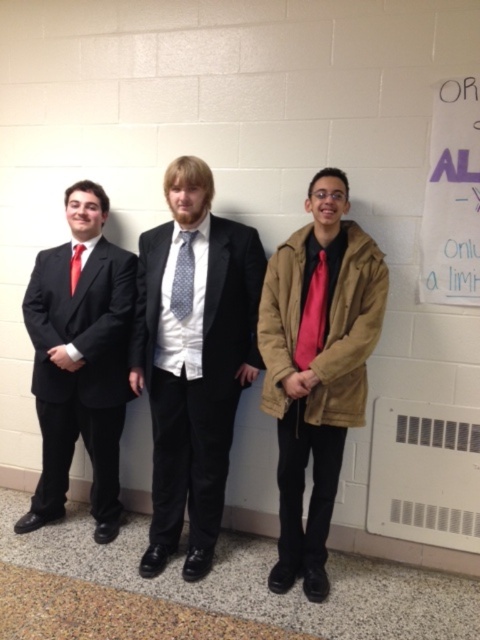
Is point (88, 380) positioned behind point (76, 275)?

No, (88, 380) is closer to viewer.

Does matte black suit at left lie behind matte red tie at left?

That is False.

This screenshot has width=480, height=640. I want to click on matte black suit at left, so click(x=80, y=362).

Can you confirm if tan suede jacket at center is shorter than matte red tie at left?

No, tan suede jacket at center is not shorter than matte red tie at left.

Is tan suede jacket at center to the right of matte red tie at left from the viewer's perspective?

Yes, tan suede jacket at center is to the right of matte red tie at left.

Locate an element on the screen. This screenshot has height=640, width=480. tan suede jacket at center is located at coordinates (316, 365).

Image resolution: width=480 pixels, height=640 pixels. Describe the element at coordinates (316, 365) in the screenshot. I see `tan suede jacket at center` at that location.

Between tan suede jacket at center and gray dotted tie at center, which one has more height?

tan suede jacket at center is taller.

This screenshot has width=480, height=640. In order to click on tan suede jacket at center in this screenshot , I will do `click(316, 365)`.